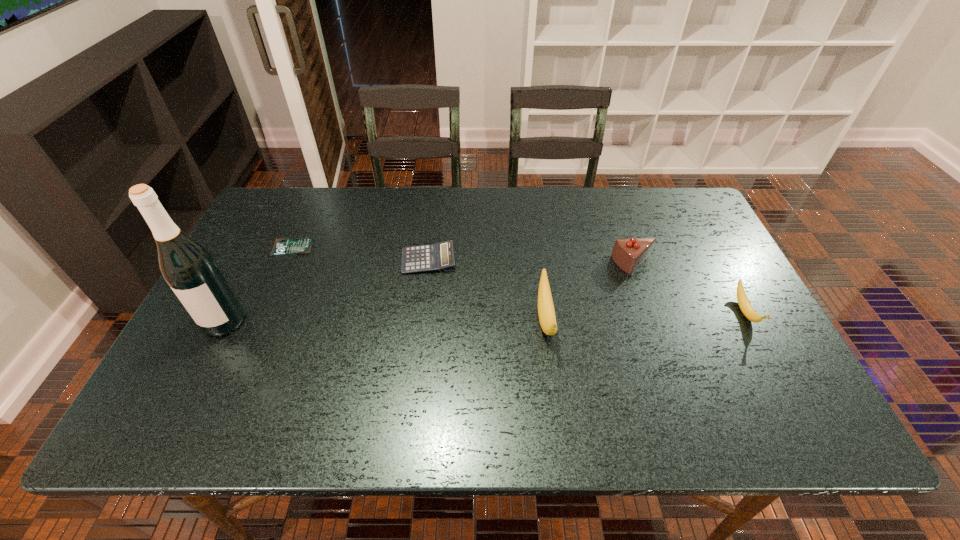
Identify the location of free point at the far left corner. The image size is (960, 540). (275, 194).

Where is `vacant space at the near left corner of the desktop`? This screenshot has width=960, height=540. vacant space at the near left corner of the desktop is located at coordinates (198, 386).

You are a GUI agent. You are given a task and a screenshot of the screen. Output one action in this format:
    pyautogui.click(x=<x>, y=<y>)
    Task: Click on the free space at the far right corner
    This screenshot has width=960, height=540.
    Given the screenshot: What is the action you would take?
    pyautogui.click(x=672, y=215)

Locate an element on the screen. Image resolution: width=960 pixels, height=540 pixels. free point between the second tallest object and the second object from right to left is located at coordinates (x=589, y=292).

Image resolution: width=960 pixels, height=540 pixels. Find the location of `empty location between the second shortest object and the identity card`. empty location between the second shortest object and the identity card is located at coordinates (360, 253).

Find the location of `unoccupied position between the second object from right to left and the shortest object`. unoccupied position between the second object from right to left and the shortest object is located at coordinates (463, 256).

Where is `vacant area between the second object from right to left and the third shortest object`? The height and width of the screenshot is (540, 960). vacant area between the second object from right to left and the third shortest object is located at coordinates (689, 288).

Image resolution: width=960 pixels, height=540 pixels. Identify the location of vacant area that lies between the chocolate cake and the shortest object. (463, 256).

Identify the location of free point between the left banana and the tallest object. The image size is (960, 540). (385, 320).

The width and height of the screenshot is (960, 540). I want to click on free spot between the left banana and the fourth object from right to left, so click(487, 289).